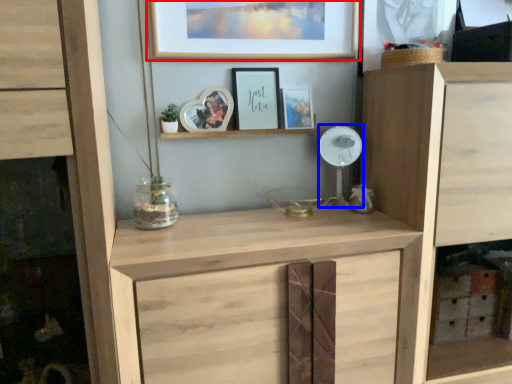
Question: Which object is closer to the camera taking this photo, picture frame (highlighted by a red box) or fan (highlighted by a blue box)?

Choices:
 (A) picture frame
 (B) fan

Answer: (A)